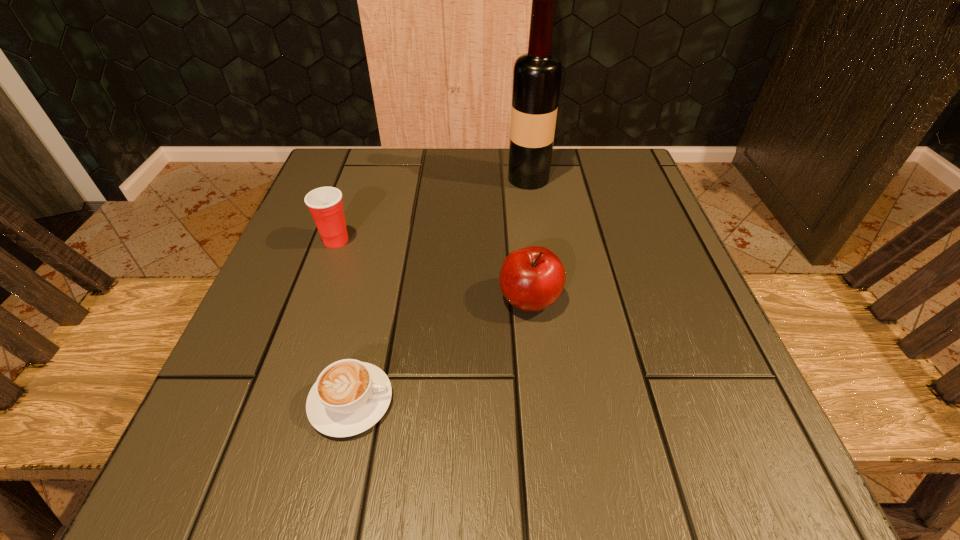
This screenshot has width=960, height=540. I want to click on unoccupied area between the second object from left to right and the farthest object, so click(x=440, y=289).

Locate an element on the screen. This screenshot has width=960, height=540. free point between the Dixie cup and the farthest object is located at coordinates (432, 210).

You are a GUI agent. You are given a task and a screenshot of the screen. Output one action in this format:
    pyautogui.click(x=<x>, y=<y>)
    Task: Click on the object that can be found as the closest to the tallest object
    This screenshot has height=540, width=960.
    Given the screenshot: What is the action you would take?
    pyautogui.click(x=532, y=278)

Select which object appears as the second closest to the tallest object. Please provide its 2D coordinates. Your answer should be formatted as a tuple, i.e. [(x, y)], where the tuple contains the x and y coordinates of a point satisfying the conditions above.

[(325, 204)]

Identify the location of free space that satisfies the following two spatial constraints: 1. on the front side of the tallest object; 2. on the side of the cappuccino with the handle. This screenshot has width=960, height=540. (560, 401).